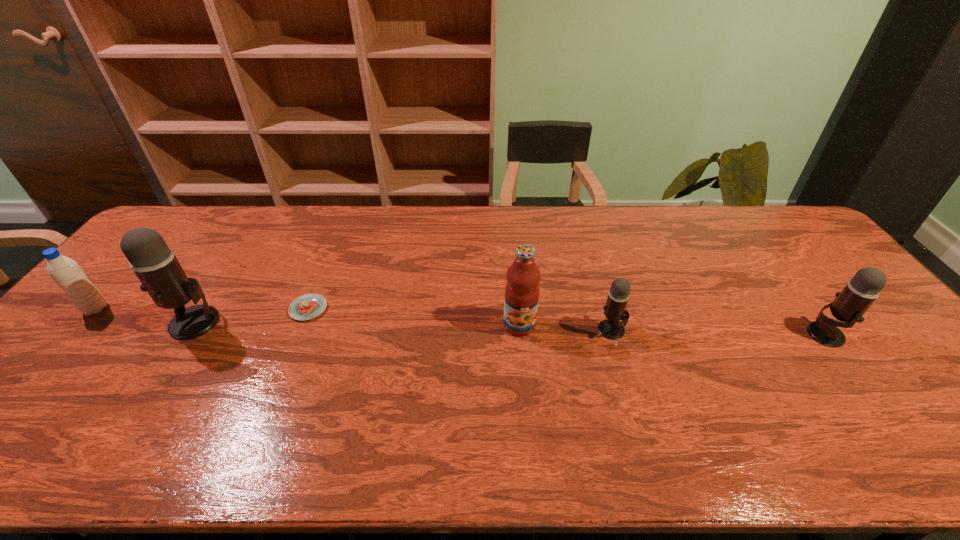
This screenshot has width=960, height=540. What are the coordinates of `the third closest object to the tallest microphone` in the screenshot? It's located at (523, 276).

In order to click on object that is the closest to the fruit juice in this screenshot , I will do `click(611, 328)`.

Locate an element on the screen. the closest microphone to the tallest microphone is located at coordinates (611, 328).

Select which microphone appears as the closest to the shortest microphone. Please provide its 2D coordinates. Your answer should be formatted as a tuple, i.e. [(x, y)], where the tuple contains the x and y coordinates of a point satisfying the conditions above.

[(850, 304)]

This screenshot has width=960, height=540. In order to click on free spot that satisfies the following two spatial constraints: 1. on the front side of the leftmost microphone; 2. on the right side of the water bottle in this screenshot , I will do `click(84, 322)`.

This screenshot has width=960, height=540. I want to click on free point that satisfies the following two spatial constraints: 1. on the back side of the tallest microphone; 2. on the left side of the fourth object from right to left, so click(x=204, y=309).